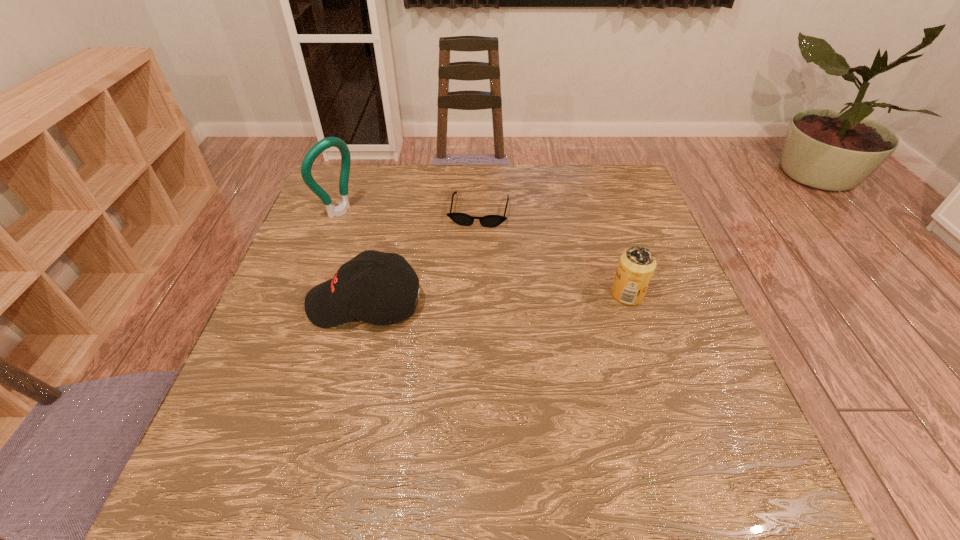
I want to click on vacant area at the far edge, so click(x=434, y=173).

Find the location of a particular element. Image resolution: width=960 pixels, height=540 pixels. vacant space at the right edge of the desktop is located at coordinates (622, 309).

Find the location of a particular element. free space at the far left corner is located at coordinates click(x=334, y=170).

The image size is (960, 540). I want to click on vacant point at the near left corner, so click(x=304, y=410).

You are a GUI agent. You are given a task and a screenshot of the screen. Output one action in this format:
    pyautogui.click(x=<x>, y=<y>)
    Task: Click on the vacant region at the far right corner of the desktop
    This screenshot has height=540, width=960.
    Given the screenshot: What is the action you would take?
    pyautogui.click(x=631, y=170)

Where is `vacant region at the near right corner of the desktop`? Image resolution: width=960 pixels, height=540 pixels. vacant region at the near right corner of the desktop is located at coordinates (708, 435).

Where is `vacant space in between the sunglasses and the baseball cap`? The height and width of the screenshot is (540, 960). vacant space in between the sunglasses and the baseball cap is located at coordinates (421, 258).

You are a GUI agent. You are given a task and a screenshot of the screen. Output one action in this format:
    pyautogui.click(x=<x>, y=<y>)
    Task: Click on the vacant space that is in between the third object from left to right and the rightmost object
    Image resolution: width=960 pixels, height=540 pixels.
    Given the screenshot: What is the action you would take?
    pyautogui.click(x=553, y=253)

Locate an element on the screen. free space between the bottle opener and the baseball cap is located at coordinates (352, 258).

Locate an element on the screen. vacant area between the tallest object and the rightmost object is located at coordinates (484, 253).